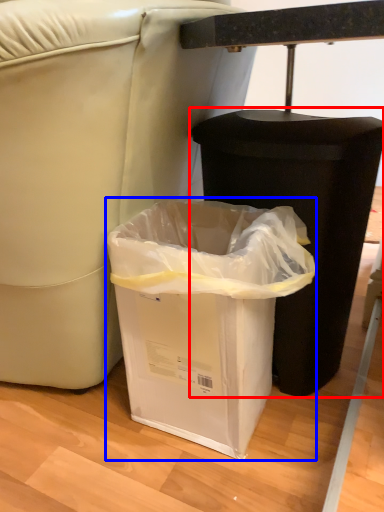
Question: Which of the following is the closest to the observer, waste container (highlighted by a red box) or waste container (highlighted by a blue box)?

Choices:
 (A) waste container
 (B) waste container

Answer: (B)